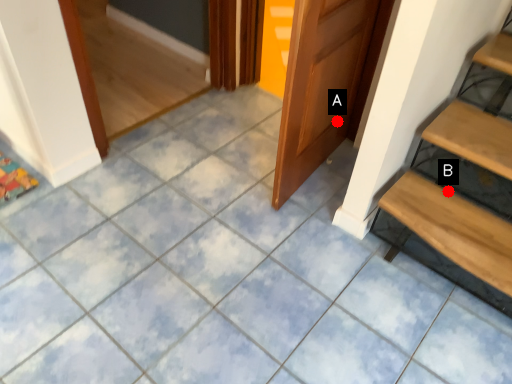
Question: Two points are circled on the image, labeled by A and B beside each circle. Which of the following is the closest to the observer?

Choices:
 (A) A is closer
 (B) B is closer

Answer: (B)